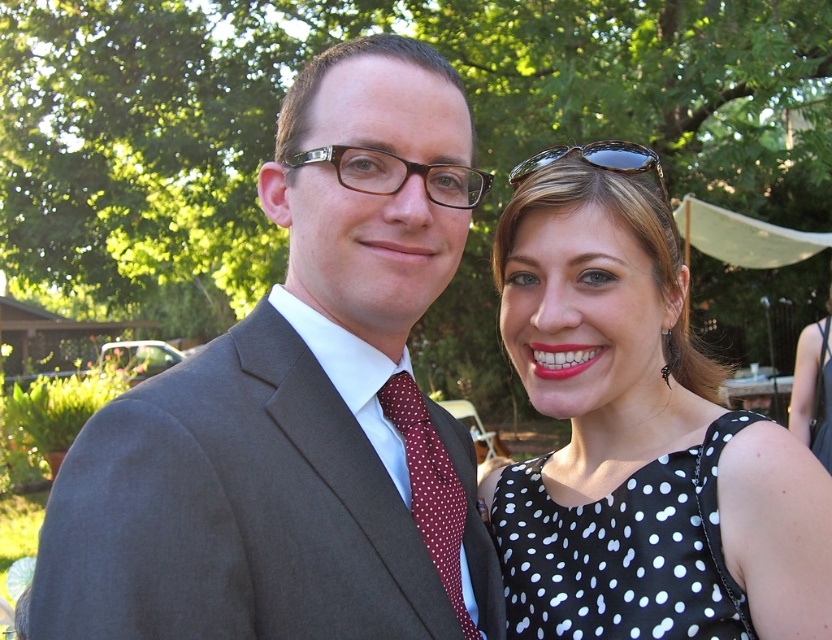
Question: Which object appears farthest from the camera in this image?

Choices:
 (A) black plastic sunglasses at upper right
 (B) black dotted fabric dress at right
 (C) red dotted fabric tie at center

Answer: (A)

Question: Can you confirm if black plastic glasses at center is smaller than black plastic sunglasses at upper right?

Choices:
 (A) no
 (B) yes

Answer: (B)

Question: Is matte gray suit at center positioned behind black plastic glasses at center?

Choices:
 (A) yes
 (B) no

Answer: (B)

Question: Which of these objects is positioned closest to the matte gray suit at center?

Choices:
 (A) red dotted fabric tie at center
 (B) black plastic sunglasses at upper right

Answer: (A)

Question: Is black dotted dress at upper right thinner than black plastic glasses at center?

Choices:
 (A) yes
 (B) no

Answer: (B)

Question: Estimate the real-world distances between objects in this image. Which object is closer to the red dotted fabric tie at center?

Choices:
 (A) black dotted fabric dress at right
 (B) black plastic sunglasses at upper right

Answer: (A)